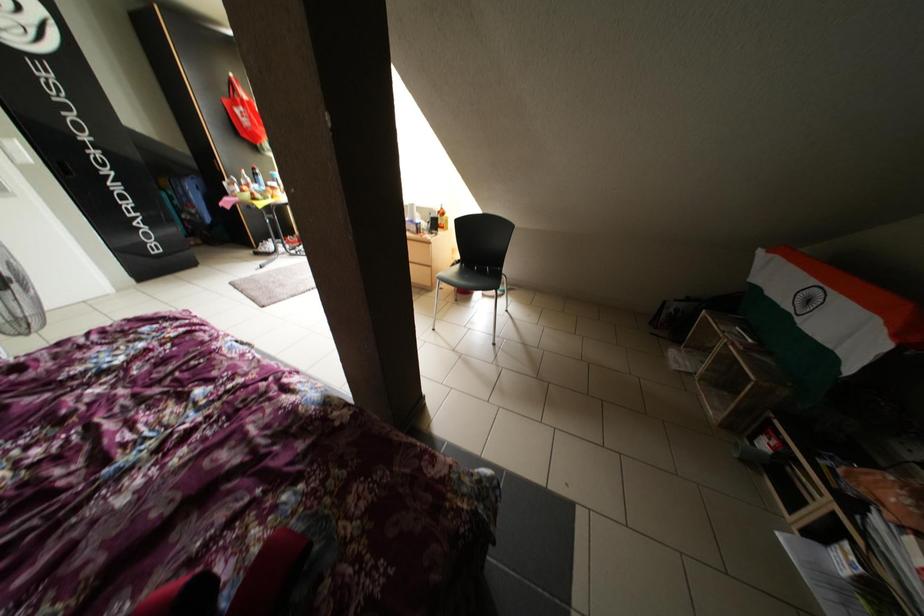
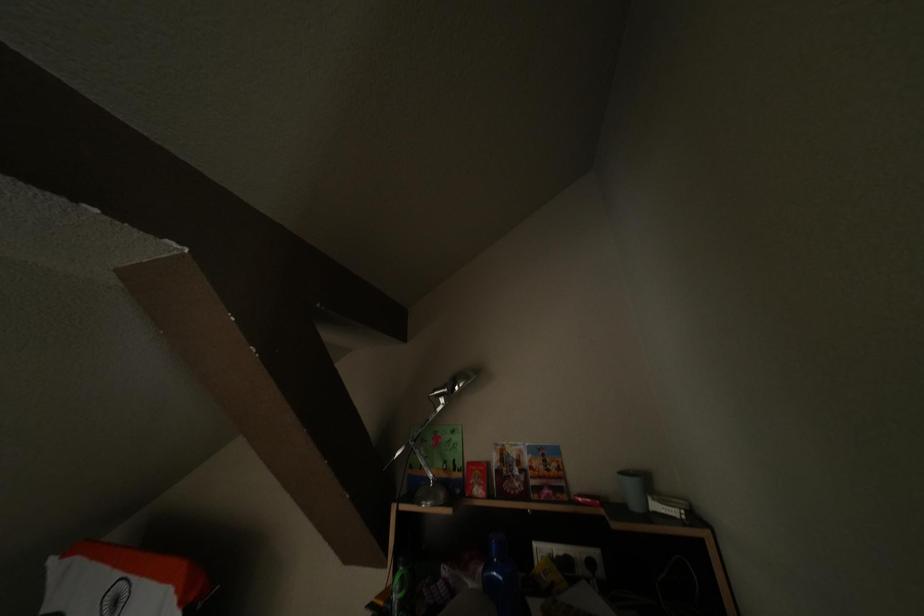
Question: The camera is either moving clockwise (left) or counter-clockwise (right) around the object. The first image is from the beginning of the video and the second image is from the end. Is the camera moving left or right when shooting the video?

Choices:
 (A) Left
 (B) Right

Answer: (A)